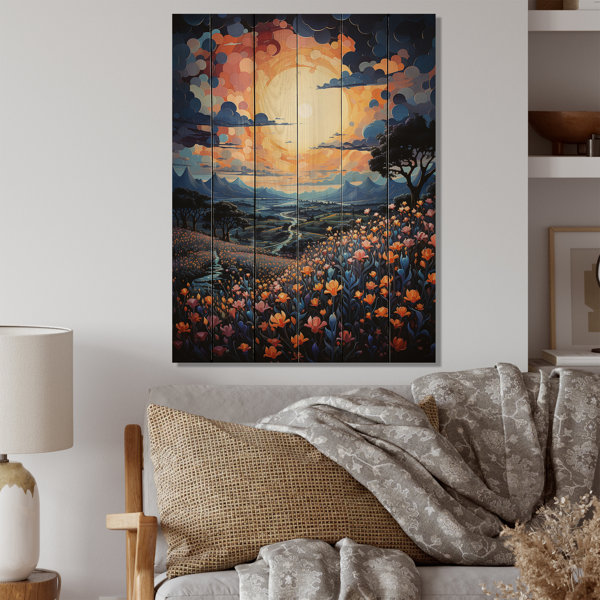
At what (x,y) coordinates should I click in order to perform the action: click on sky in painting. Please return your answer as a coordinate pair (x, y). This screenshot has width=600, height=600. Looking at the image, I should click on (229, 85), (407, 53).